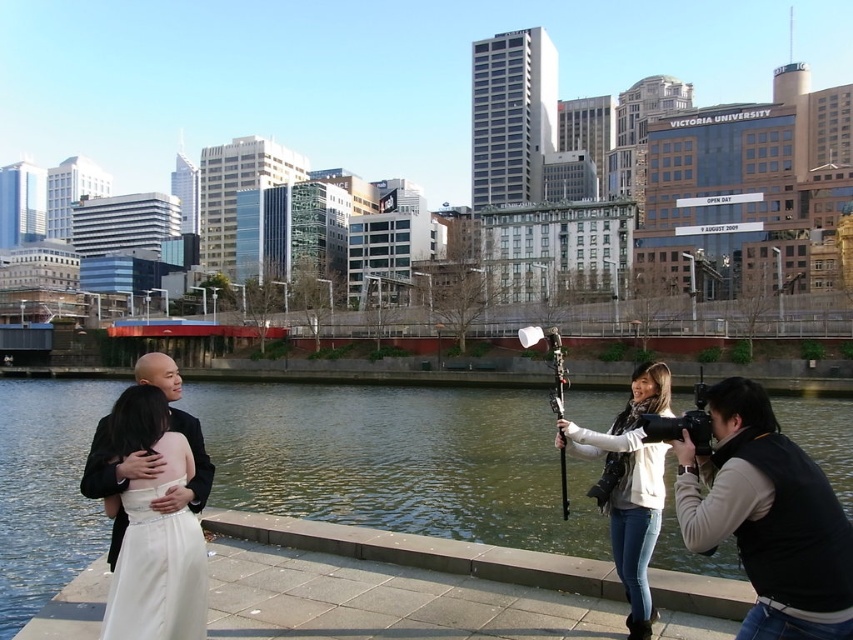
Question: Does white satin dress at lower left appear on the left side of black satin suit at left?

Choices:
 (A) no
 (B) yes

Answer: (A)

Question: Which point is closer to the camera?

Choices:
 (A) (143, 356)
 (B) (828, 596)
 (C) (173, 595)

Answer: (B)

Question: In this image, where is black vest at lower right located relative to white satin dress at lower left?

Choices:
 (A) above
 (B) below

Answer: (A)

Question: Which object is the farthest from the greenish water at center?

Choices:
 (A) black satin suit at left
 (B) white satin dress at lower left

Answer: (A)

Question: Among these points, which one is farthest from the camera?

Choices:
 (A) (233, 440)
 (B) (668, 410)
 (C) (202, 456)
 (D) (136, 589)

Answer: (A)

Question: Does black vest at lower right appear on the right side of white matte jacket at lower right?

Choices:
 (A) yes
 (B) no

Answer: (A)